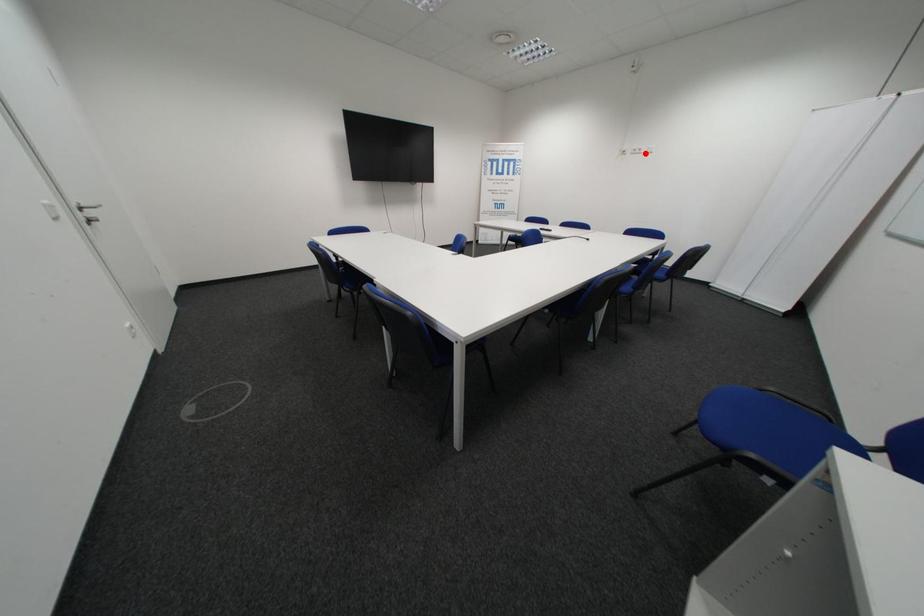
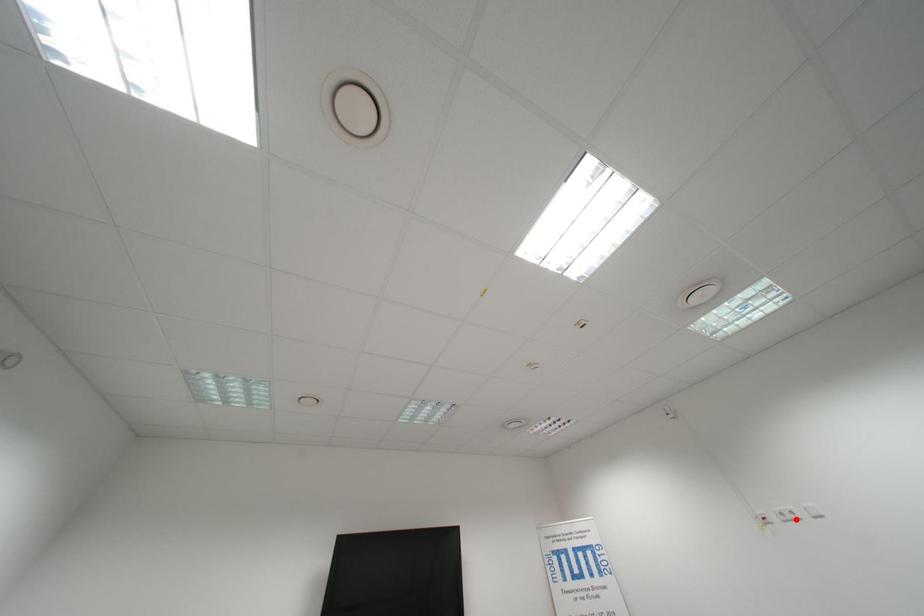
I am providing you with two images of the same scene from different viewpoints. A red point is marked on the first image and another point is marked on the second image. Does the point marked in image1 correspond to the same location as the one in image2?

Yes